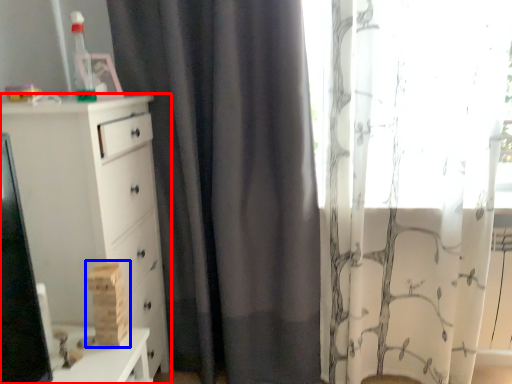
Question: Among these objects, which one is nearest to the camera, chest of drawers (highlighted by a red box) or toy (highlighted by a blue box)?

Choices:
 (A) chest of drawers
 (B) toy

Answer: (A)